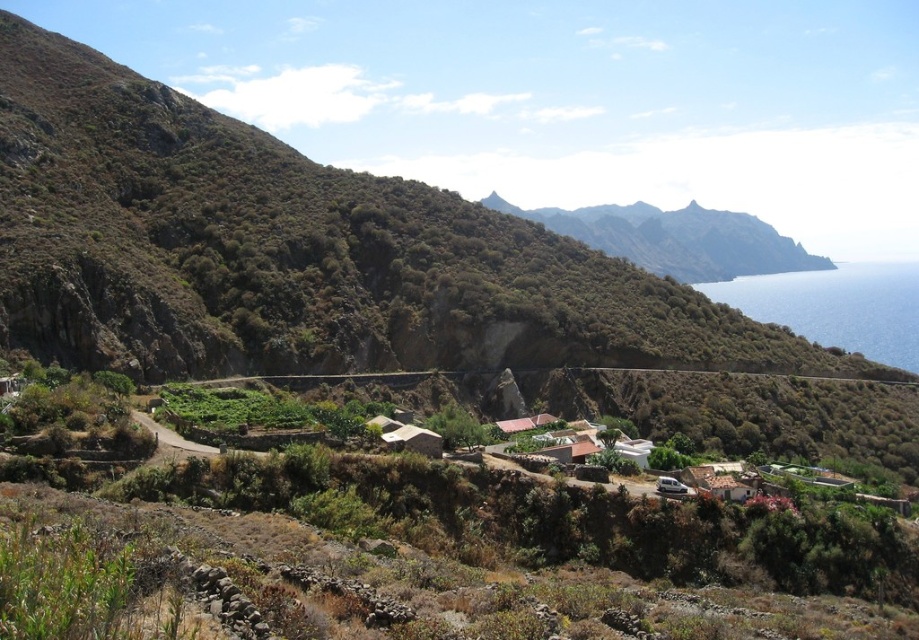
Does green textured mountain at upper center have a greater width compared to blue water at right?

In fact, green textured mountain at upper center might be narrower than blue water at right.

Is green textured mountain at upper center smaller than blue water at right?

Correct, green textured mountain at upper center occupies less space than blue water at right.

Is point (593, 220) more distant than point (830, 321)?

Yes, point (593, 220) is farther from viewer.

This screenshot has height=640, width=919. Find the location of `green textured mountain at upper center`. green textured mountain at upper center is located at coordinates (676, 237).